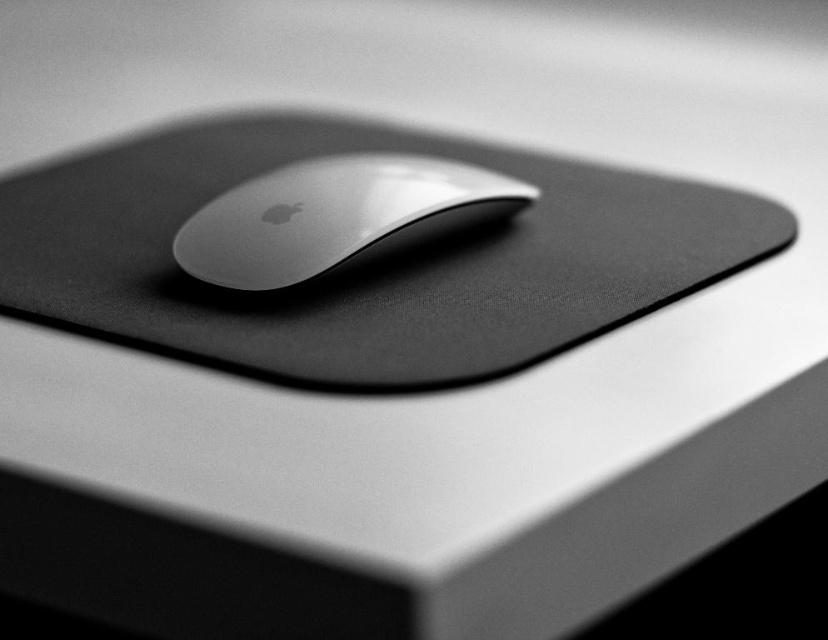
You are setting up a new workspace and want to ensure proper ergonomics. Given that the black matte mousepad at center and the sleek silver mouse at center are part of your setup, which object should you adjust if you want to raise the height of the mouse to a more comfortable position?

The black matte mousepad at center has a greater height compared to the sleek silver mouse at center. To raise the mouse, you can place the sleek silver mouse at center on top of the black matte mousepad at center, utilizing its elevated surface for better ergonomics.

You are setting up a workspace and need to place a keyboard to the left of the sleek silver mouse at center. Where should you position the keyboard relative to the black matte mousepad at center?

The black matte mousepad at center is to the right of the sleek silver mouse at center. Therefore, placing the keyboard to the left of the sleek silver mouse at center would position it to the left of the black matte mousepad at center as well.

You are setting up a workspace and want to place the sleek silver mouse at center on the black matte mousepad at center. Can the mouse fit entirely on the mousepad without any part hanging off?

The black matte mousepad at center has a larger width than the sleek silver mouse at center, so yes, the mouse can fit entirely on the mousepad without any part hanging off.